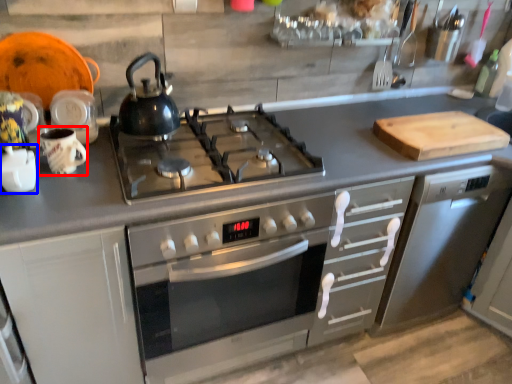
Question: Which object appears closest to the camera in this image, mug (highlighted by a red box) or appliance (highlighted by a blue box)?

Choices:
 (A) mug
 (B) appliance

Answer: (B)